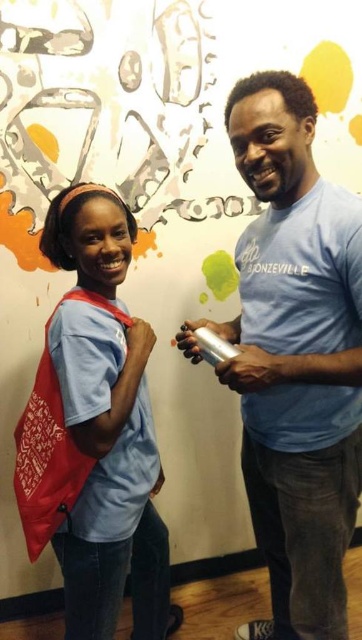
I want to click on metallic canister at right, so click(x=295, y=356).

Does metallic canister at right have a lesser width compared to matte blue shirt at center?

In fact, metallic canister at right might be wider than matte blue shirt at center.

The height and width of the screenshot is (640, 362). What are the coordinates of `metallic canister at right` in the screenshot? It's located at (295, 356).